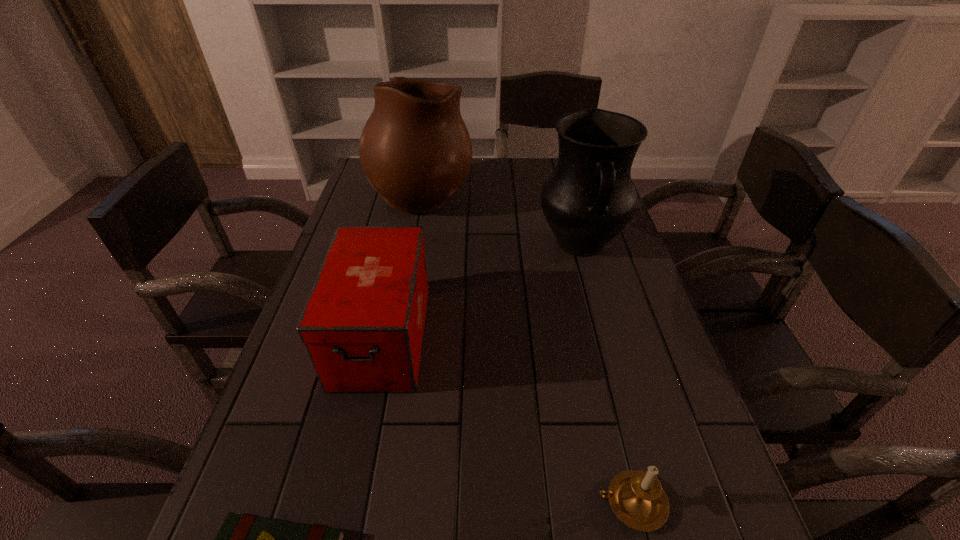
The width and height of the screenshot is (960, 540). In order to click on cream pitcher in this screenshot , I will do `click(415, 150)`.

This screenshot has height=540, width=960. I want to click on pitcher, so click(x=589, y=198).

At what (x,y) coordinates should I click in order to perform the action: click on the third tallest object. Please return your answer as a coordinate pair (x, y). Image resolution: width=960 pixels, height=540 pixels. Looking at the image, I should click on (363, 323).

I want to click on the third farthest object, so click(x=363, y=323).

At what (x,y) coordinates should I click in order to perform the action: click on the fourth tallest object. Please return your answer as a coordinate pair (x, y). This screenshot has width=960, height=540. Looking at the image, I should click on (636, 497).

Find the location of a particular element. vacant space located 0.350m at the spout of the cream pitcher is located at coordinates (576, 190).

Locate an element on the screen. This screenshot has height=540, width=960. free space located 0.190m on the handle side of the pitcher is located at coordinates pos(604,329).

I want to click on vacant space situated on the handle side of the third nearest object, so pos(354,464).

You are a GUI agent. You are given a task and a screenshot of the screen. Output one action in this format:
    pyautogui.click(x=<x>, y=<y>)
    Task: Click on the vacant space positioned with a handle on the side of the fourth tallest object
    
    Given the screenshot: What is the action you would take?
    pyautogui.click(x=414, y=503)

Find the location of a particular element. The image size is (960, 540). vacant space situated with a handle on the side of the fourth tallest object is located at coordinates point(448,503).